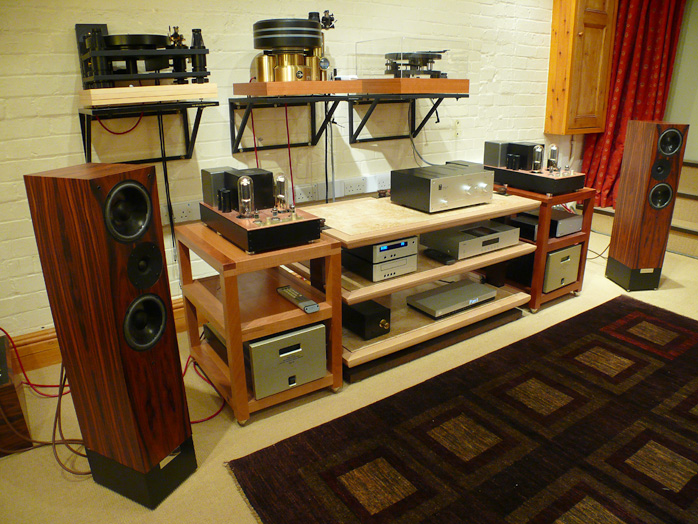
Where is `left wall shlf`? left wall shlf is located at coordinates (163, 103).